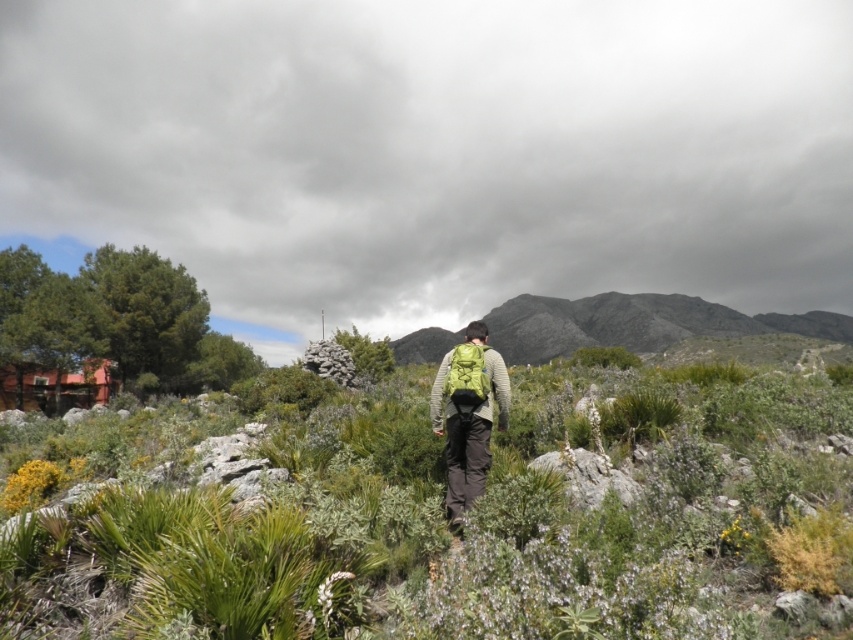
Consider the image. What are the coordinates of the gray rocky mountain at center?

The gray rocky mountain at center is located at coordinates point (635, 323).